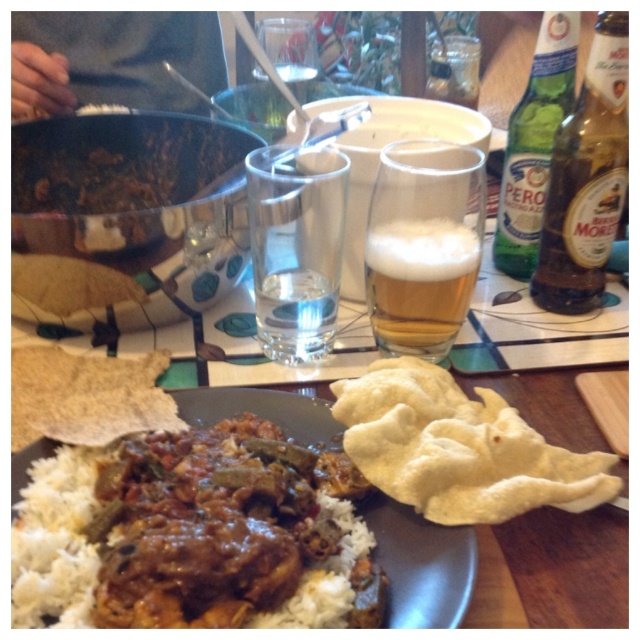
You are at a dinner table and want to pour water from the brown glass bottle at upper right into the clear glass water at center. Can you do this without moving any other items?

The brown glass bottle at upper right is positioned on the right side of clear glass water at center, so you can pour water from the brown glass bottle at upper right into the clear glass water at center without moving other items.

Based on the photo, you are at a dinner table and want to pour the foamy golden beer at center into a glass that is currently empty. Which direction should you move your hand to reach the empty glass from the white matte rice at lower left?

You should move your hand to the right from the white matte rice at lower left to reach the foamy golden beer at center, as the white matte rice at lower left is to the left of the foamy golden beer at center.

In the scene shown: You are a guest at a dinner table and want to compare the sizes of the white fluffy flatbread at lower right and the brown glass bottle at upper right. Which one is larger?

The brown glass bottle at upper right is larger than the white fluffy flatbread at lower right.